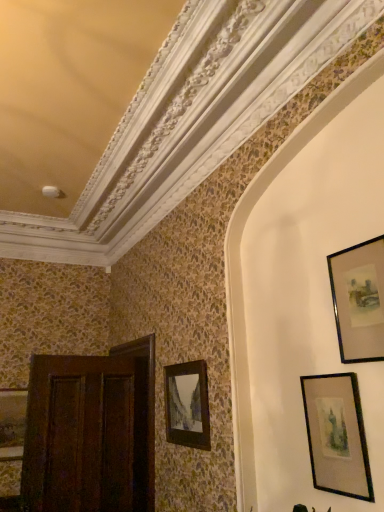
Question: Is black matte picture frame at lower right, the 2th picture frame in the top-to-bottom sequence, to the left of wooden picture frame at center, the 2th picture frame from the bottom, from the viewer's perspective?

Choices:
 (A) no
 (B) yes

Answer: (A)

Question: Is black matte picture frame at lower right, the 2th picture frame from the right, beside wooden picture frame at center, which is counted as the 3th picture frame, starting from the right?

Choices:
 (A) no
 (B) yes

Answer: (A)

Question: From the image's perspective, is black matte picture frame at lower right, placed as the third picture frame when sorted from left to right, on wooden picture frame at center, the 2th picture frame from the bottom?

Choices:
 (A) yes
 (B) no

Answer: (A)

Question: Can you confirm if black matte picture frame at lower right, placed as the third picture frame when sorted from left to right, is bigger than wooden picture frame at center, the 2th picture frame from the bottom?

Choices:
 (A) no
 (B) yes

Answer: (A)

Question: From a real-world perspective, is black matte picture frame at lower right, the 2th picture frame from the right, under wooden picture frame at center, placed as the 2th picture frame when sorted from back to front?

Choices:
 (A) yes
 (B) no

Answer: (A)

Question: Considering the relative sizes of black matte picture frame at lower right, acting as the third picture frame starting from the bottom, and wooden picture frame at center, which is counted as the 3th picture frame, starting from the front, in the image provided, is black matte picture frame at lower right, acting as the third picture frame starting from the bottom, smaller than wooden picture frame at center, which is counted as the 3th picture frame, starting from the front,?

Choices:
 (A) no
 (B) yes

Answer: (B)

Question: Would you say matte black picture frame at left, the fourth picture frame when ordered from front to back, is a long distance from black glossy picture frame at upper right, the 1th picture frame positioned from the right?

Choices:
 (A) no
 (B) yes

Answer: (B)

Question: Considering the relative sizes of matte black picture frame at left, marked as the fourth picture frame in a top-to-bottom arrangement, and black glossy picture frame at upper right, the 1th picture frame when ordered from top to bottom, in the image provided, is matte black picture frame at left, marked as the fourth picture frame in a top-to-bottom arrangement, thinner than black glossy picture frame at upper right, the 1th picture frame when ordered from top to bottom,?

Choices:
 (A) yes
 (B) no

Answer: (B)

Question: From a real-world perspective, is matte black picture frame at left, the 1th picture frame in the bottom-to-top sequence, physically below black glossy picture frame at upper right, arranged as the 4th picture frame when viewed from the left?

Choices:
 (A) no
 (B) yes

Answer: (B)

Question: Considering the relative positions of matte black picture frame at left, marked as the fourth picture frame in a top-to-bottom arrangement, and black glossy picture frame at upper right, the first picture frame in the front-to-back sequence, in the image provided, is matte black picture frame at left, marked as the fourth picture frame in a top-to-bottom arrangement, in front of black glossy picture frame at upper right, the first picture frame in the front-to-back sequence,?

Choices:
 (A) yes
 (B) no

Answer: (B)

Question: Would you say matte black picture frame at left, the 1th picture frame in the bottom-to-top sequence, is outside black glossy picture frame at upper right, the 1th picture frame positioned from the right?

Choices:
 (A) no
 (B) yes

Answer: (B)

Question: Does matte black picture frame at left, acting as the 1th picture frame starting from the back, come behind black glossy picture frame at upper right, the 4th picture frame viewed from the back?

Choices:
 (A) no
 (B) yes

Answer: (B)

Question: Can you confirm if wooden picture frame at center, which is counted as the 3th picture frame, starting from the right, is wider than black glossy picture frame at upper right, marked as the 4th picture frame in a bottom-to-top arrangement?

Choices:
 (A) yes
 (B) no

Answer: (A)